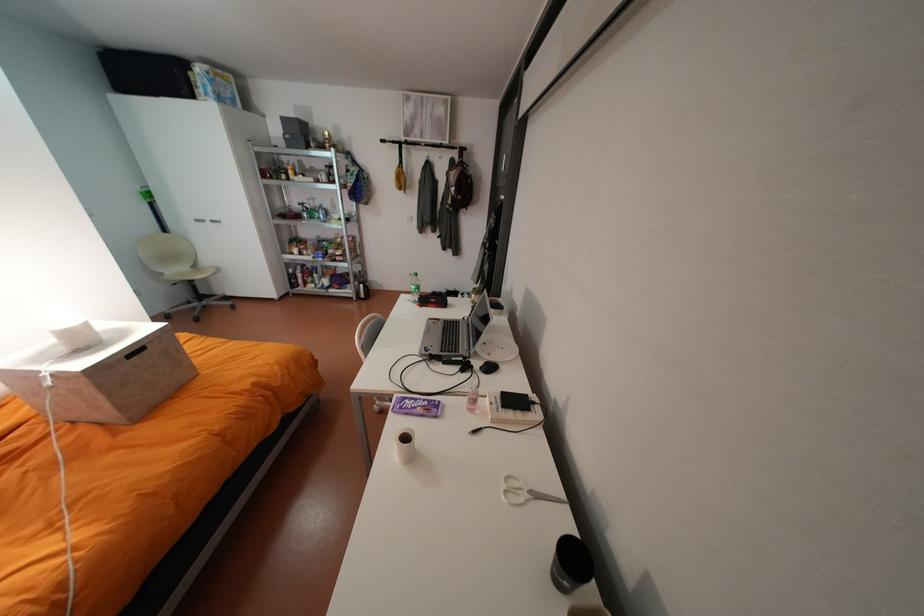
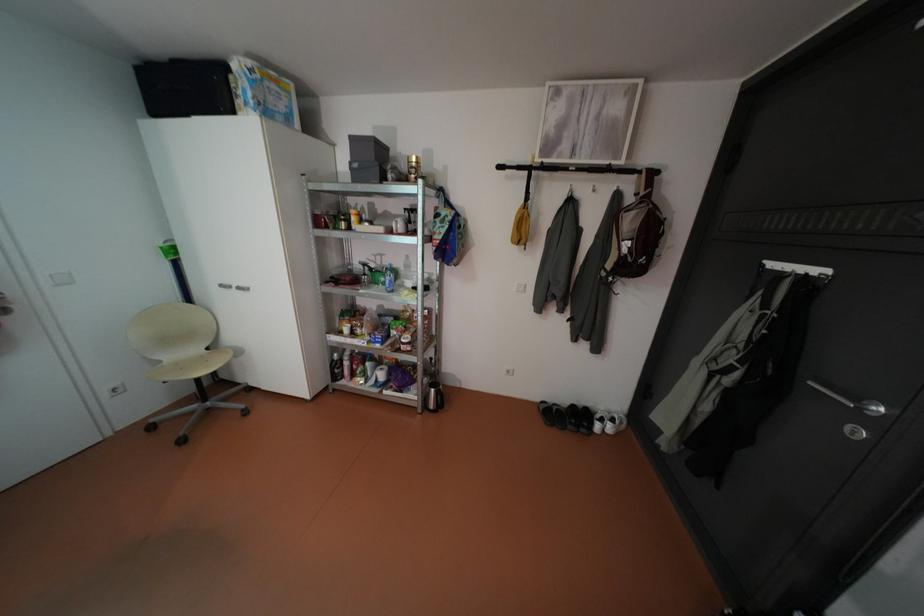
The point at (462, 191) is marked in the first image. Where is the corresponding point in the second image?

(634, 249)